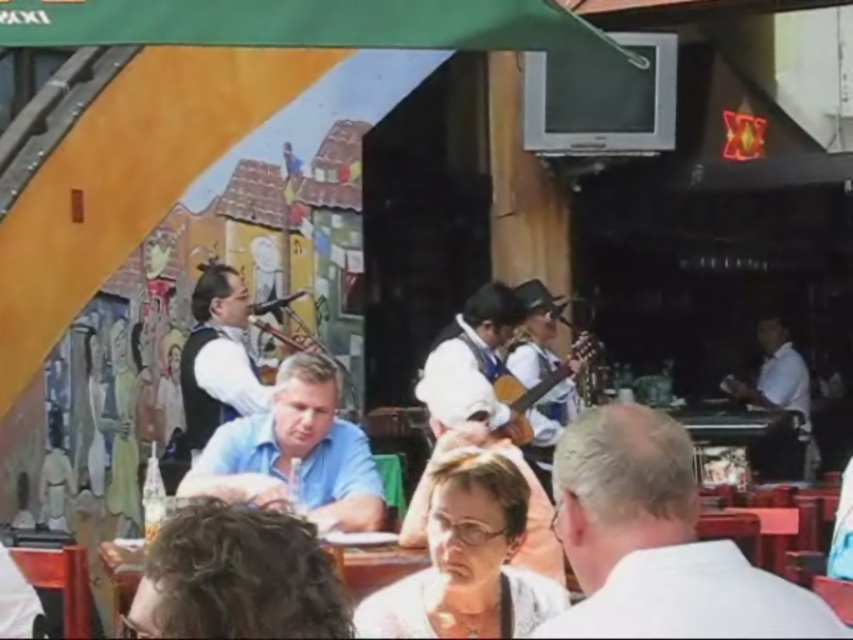
Question: Is white smooth shirt at right positioned at the back of wooden acoustic guitar at center?

Choices:
 (A) no
 (B) yes

Answer: (B)

Question: Can you confirm if blue cotton shirt at center is positioned to the left of white fabric shirt at center?

Choices:
 (A) yes
 (B) no

Answer: (B)

Question: Can you confirm if blue cotton shirt at center is bigger than white fabric shirt at center?

Choices:
 (A) yes
 (B) no

Answer: (A)

Question: Among these points, which one is nearest to the camera?

Choices:
 (A) (585, 544)
 (B) (357, 429)

Answer: (A)

Question: Which object is closer to the camera taking this photo?

Choices:
 (A) white matte shirt at center
 (B) blue cotton shirt at center
 (C) white smooth shirt at right
 (D) white fabric shirt at center

Answer: (A)

Question: Among these points, which one is nearest to the camera?

Choices:
 (A) (561, 518)
 (B) (194, 417)
 (C) (778, 406)

Answer: (A)